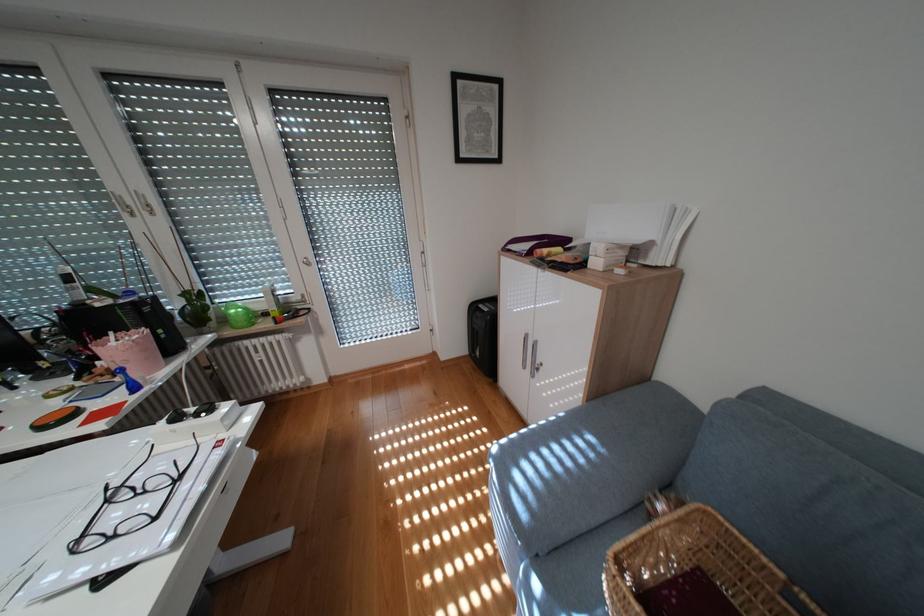
What do you see at coordinates (130, 353) in the screenshot? I see `the pink pen holder` at bounding box center [130, 353].